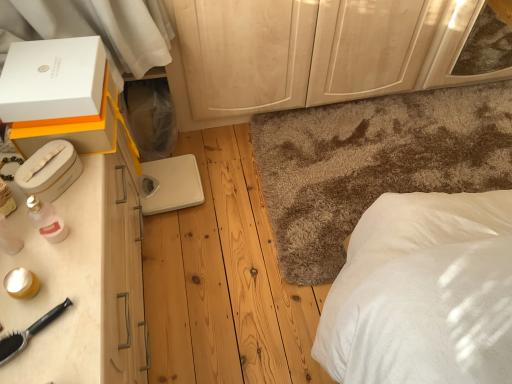
Question: From a real-world perspective, is white matte box at upper left, which ranks as the 3th box in bottom-to-top order, located beneath white plastic box at left, marked as the 1th box in a bottom-to-top arrangement?

Choices:
 (A) yes
 (B) no

Answer: (B)

Question: Is white plastic box at left, marked as the 1th box in a bottom-to-top arrangement, completely or partially inside white matte box at upper left, which appears as the first box when viewed from the top?

Choices:
 (A) yes
 (B) no

Answer: (B)

Question: Does white matte box at upper left, which ranks as the 3th box in bottom-to-top order, have a larger size compared to white plastic box at left, which appears as the 3th box when viewed from the top?

Choices:
 (A) no
 (B) yes

Answer: (B)

Question: From the image's perspective, would you say white matte box at upper left, which appears as the first box when viewed from the top, is shown under white plastic box at left, which appears as the 3th box when viewed from the top?

Choices:
 (A) yes
 (B) no

Answer: (B)

Question: Is white matte box at upper left, which appears as the first box when viewed from the top, further to camera compared to white plastic box at left, which appears as the 3th box when viewed from the top?

Choices:
 (A) no
 (B) yes

Answer: (B)

Question: Can you confirm if white matte box at upper left, which appears as the first box when viewed from the top, is thinner than white plastic box at left, marked as the 1th box in a bottom-to-top arrangement?

Choices:
 (A) yes
 (B) no

Answer: (B)

Question: From a real-world perspective, is shaggy carpet at center positioned under white matte box at upper left, which appears as the first box when viewed from the top, based on gravity?

Choices:
 (A) no
 (B) yes

Answer: (B)

Question: Is white matte box at upper left, which appears as the first box when viewed from the top, at the back of shaggy carpet at center?

Choices:
 (A) yes
 (B) no

Answer: (B)

Question: Is shaggy carpet at center facing towards white matte box at upper left, which appears as the first box when viewed from the top?

Choices:
 (A) yes
 (B) no

Answer: (B)

Question: Can you confirm if shaggy carpet at center is positioned to the left of white matte box at upper left, which ranks as the 3th box in bottom-to-top order?

Choices:
 (A) yes
 (B) no

Answer: (B)

Question: Is shaggy carpet at center taller than white matte box at upper left, which appears as the first box when viewed from the top?

Choices:
 (A) yes
 (B) no

Answer: (B)

Question: Is shaggy carpet at center outside of white matte box at upper left, which appears as the first box when viewed from the top?

Choices:
 (A) no
 (B) yes

Answer: (B)

Question: Could you tell me if white plastic scale at center is facing shaggy carpet at center?

Choices:
 (A) no
 (B) yes

Answer: (B)